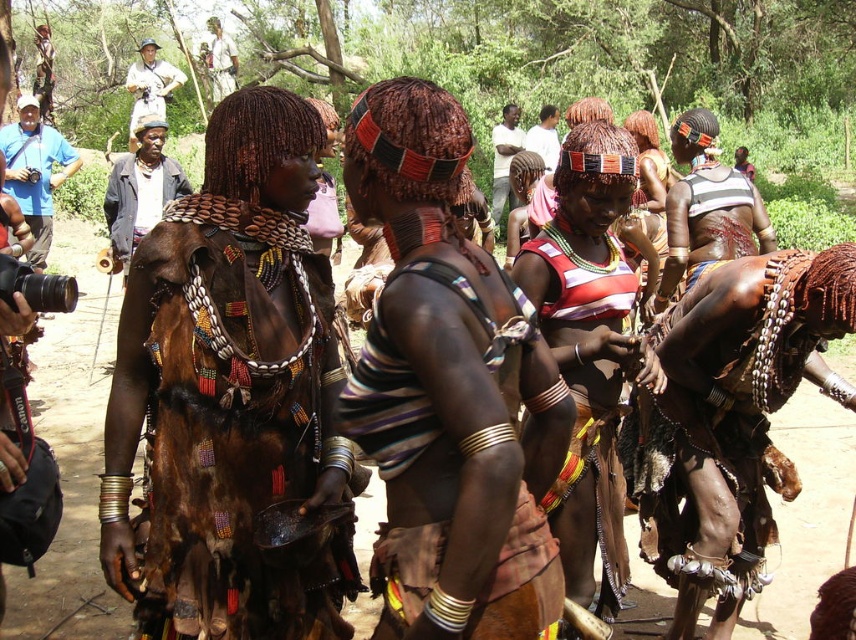
Question: Which object is the closest to the matte brown leather skirt at center?

Choices:
 (A) matte red fabric top at center
 (B) striped fabric top at center
 (C) shiny metallic skirt at center-right

Answer: (A)

Question: Can you confirm if matte brown leather skirt at center is smaller than brown leather jacket at left?

Choices:
 (A) no
 (B) yes

Answer: (B)

Question: Which object is closer to the camera taking this photo?

Choices:
 (A) white shirt at center
 (B) matte red fabric top at center
 (C) blue fabric camera at left

Answer: (B)

Question: Does brown fur at center have a greater width compared to brown leather jacket at left?

Choices:
 (A) no
 (B) yes

Answer: (B)

Question: Is shiny metallic skirt at center-right to the left of blue fabric camera at left from the viewer's perspective?

Choices:
 (A) yes
 (B) no

Answer: (B)

Question: Which point is closer to the camera?

Choices:
 (A) matte brown leather skirt at center
 (B) brown leather jacket at left
 (C) white cotton shirt at upper center
 (D) matte red fabric top at center

Answer: (A)